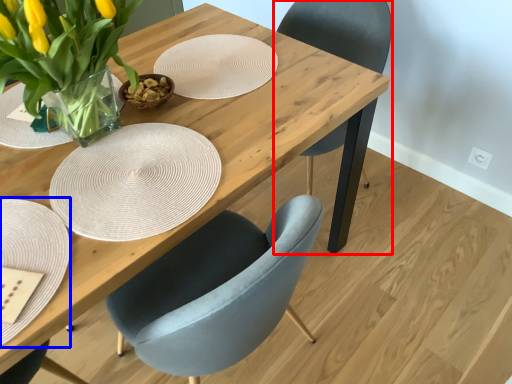
Question: Among these objects, which one is farthest to the camera, chair (highlighted by a red box) or plate (highlighted by a blue box)?

Choices:
 (A) chair
 (B) plate

Answer: (A)